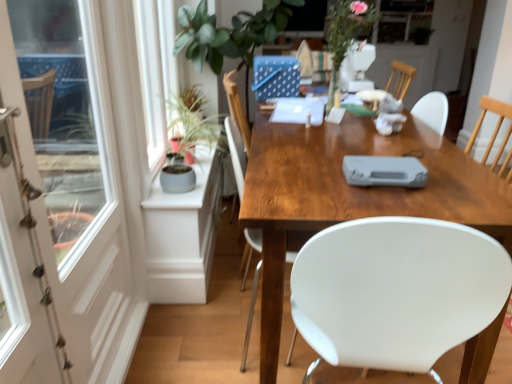
What are the coordinates of `vacant space that is to the left of floral arrangement at upper center` in the screenshot? It's located at (295, 109).